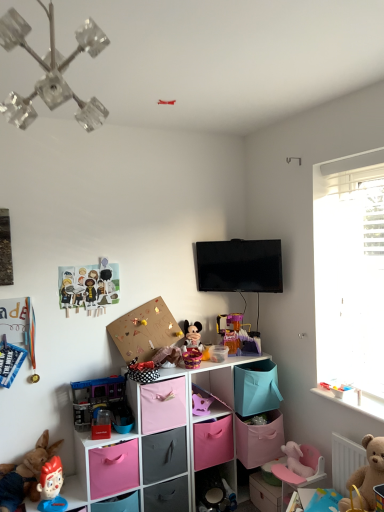
Question: Is pink fabric drawer at center, which is the second drawer from top to bottom, to the left of plastic toy figure at lower left, which is the third toy from bottom to top, from the viewer's perspective?

Choices:
 (A) no
 (B) yes

Answer: (A)

Question: Does pink fabric drawer at center, which is the second drawer from top to bottom, have a greater width compared to plastic toy figure at lower left, marked as the eighth toy in a top-to-bottom arrangement?

Choices:
 (A) yes
 (B) no

Answer: (A)

Question: Could you tell me if pink fabric drawer at center, which is the 1th drawer from bottom to top, is facing plastic toy figure at lower left, marked as the eighth toy in a top-to-bottom arrangement?

Choices:
 (A) yes
 (B) no

Answer: (B)

Question: Considering the relative sizes of pink fabric drawer at center, which is the 1th drawer from bottom to top, and plastic toy figure at lower left, which is the third toy from bottom to top, in the image provided, is pink fabric drawer at center, which is the 1th drawer from bottom to top, shorter than plastic toy figure at lower left, which is the third toy from bottom to top,?

Choices:
 (A) no
 (B) yes

Answer: (B)

Question: Is pink fabric drawer at center, which is the 1th drawer from bottom to top, further to camera compared to plastic toy figure at lower left, which is the third toy from bottom to top?

Choices:
 (A) no
 (B) yes

Answer: (B)

Question: Would you say clear crystal chandelier at upper left is inside or outside cardboard at upper center?

Choices:
 (A) outside
 (B) inside

Answer: (A)

Question: From a real-world perspective, relative to cardboard at upper center, is clear crystal chandelier at upper left vertically above or below?

Choices:
 (A) below
 (B) above

Answer: (B)

Question: Looking at the image, does clear crystal chandelier at upper left seem bigger or smaller compared to cardboard at upper center?

Choices:
 (A) small
 (B) big

Answer: (A)

Question: Based on their positions, is clear crystal chandelier at upper left located to the left or right of cardboard at upper center?

Choices:
 (A) left
 (B) right

Answer: (A)

Question: Considering the relative positions of pink fabric storage box at lower right, the 2th storage box when ordered from top to bottom, and brown plush bear at lower right, the fourth toy when ordered from bottom to top, in the image provided, is pink fabric storage box at lower right, the 2th storage box when ordered from top to bottom, to the left or to the right of brown plush bear at lower right, the fourth toy when ordered from bottom to top,?

Choices:
 (A) right
 (B) left

Answer: (B)

Question: From the image's perspective, relative to brown plush bear at lower right, the seventh toy viewed from the top, is pink fabric storage box at lower right, the first storage box ordered from the bottom, above or below?

Choices:
 (A) below
 (B) above

Answer: (A)

Question: Is pink fabric storage box at lower right, the first storage box in the right-to-left sequence, in front of or behind brown plush bear at lower right, the seventh toy viewed from the top, in the image?

Choices:
 (A) front
 (B) behind

Answer: (B)

Question: Considering the positions of point pyautogui.click(x=251, y=495) and point pyautogui.click(x=377, y=448), is point pyautogui.click(x=251, y=495) closer or farther from the camera than point pyautogui.click(x=377, y=448)?

Choices:
 (A) farther
 (B) closer

Answer: (A)

Question: Do you think matte plastic figurine at lower left, placed as the tenth toy when sorted from top to bottom, is within pink fabric storage box at lower left, acting as the first storage box starting from the left, or outside of it?

Choices:
 (A) inside
 (B) outside

Answer: (B)

Question: From a real-world perspective, is matte plastic figurine at lower left, the first toy from the bottom, positioned above or below pink fabric storage box at lower left, which is counted as the second storage box, starting from the right?

Choices:
 (A) below
 (B) above

Answer: (A)